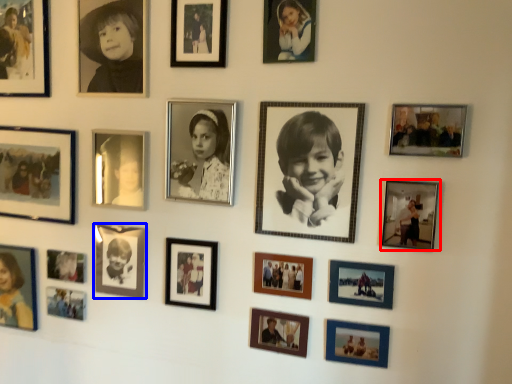
Question: Among these objects, which one is farthest to the camera, picture frame (highlighted by a red box) or picture frame (highlighted by a blue box)?

Choices:
 (A) picture frame
 (B) picture frame

Answer: (B)